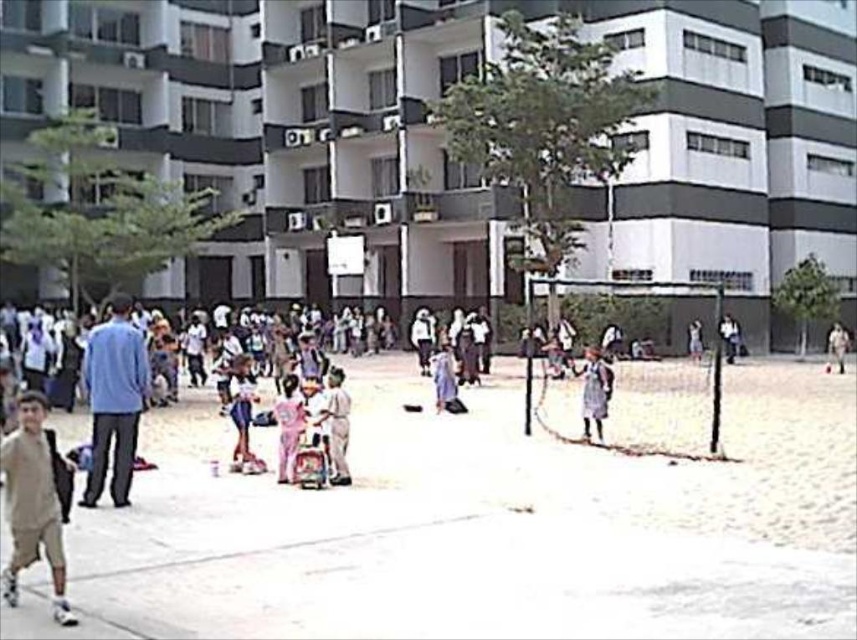
Question: Which object appears farthest from the camera in this image?

Choices:
 (A) light gray concrete pavement at center
 (B) blue cotton shirt at left
 (C) pink fabric dress at center
 (D) white matte person at center-right

Answer: (D)

Question: Which point is farther from the camera taking this photo?

Choices:
 (A) (586, 433)
 (B) (100, 397)

Answer: (A)

Question: Is light gray concrete pavement at center above light brown fabric dress at center?

Choices:
 (A) no
 (B) yes

Answer: (A)

Question: Which point is closer to the camera?

Choices:
 (A) (333, 458)
 (B) (598, 385)
 (C) (94, 497)

Answer: (C)

Question: Is light gray concrete pavement at center smaller than light brown fabric dress at center?

Choices:
 (A) no
 (B) yes

Answer: (A)

Question: Is light pink fabric dress at center closer to the viewer compared to white matte person at center-right?

Choices:
 (A) no
 (B) yes

Answer: (B)